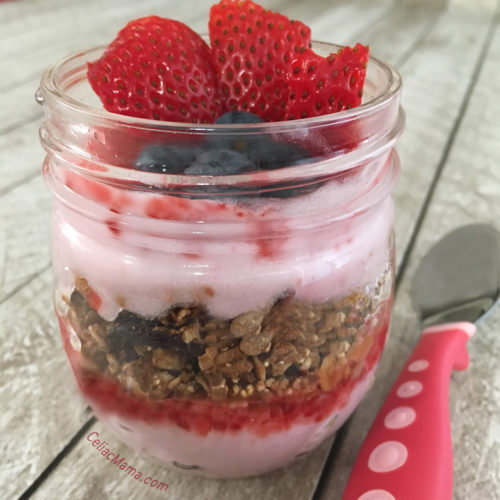
Locate an element on the screen. wood plank is located at coordinates (466, 183), (417, 187), (30, 337), (32, 126), (22, 61), (21, 104), (16, 10), (47, 20), (36, 42).